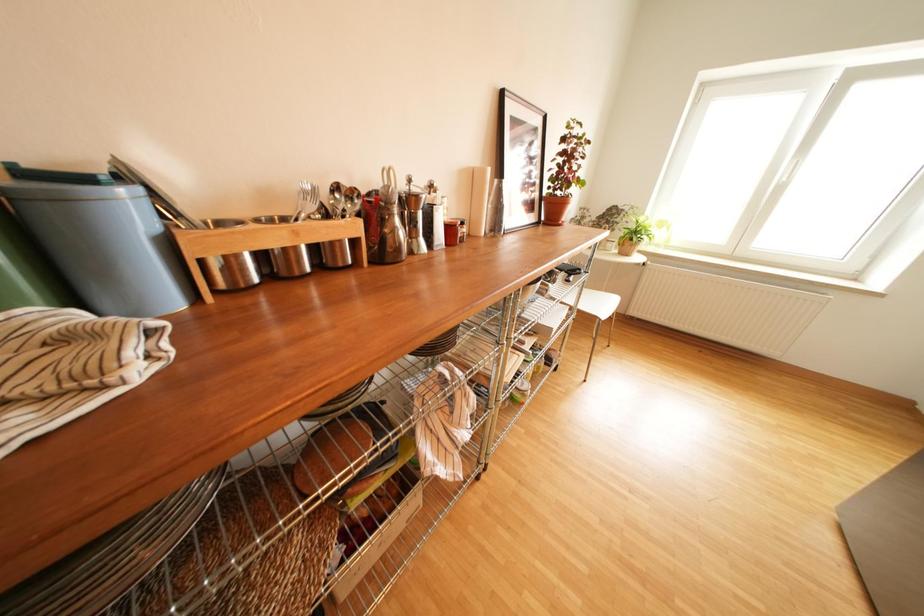
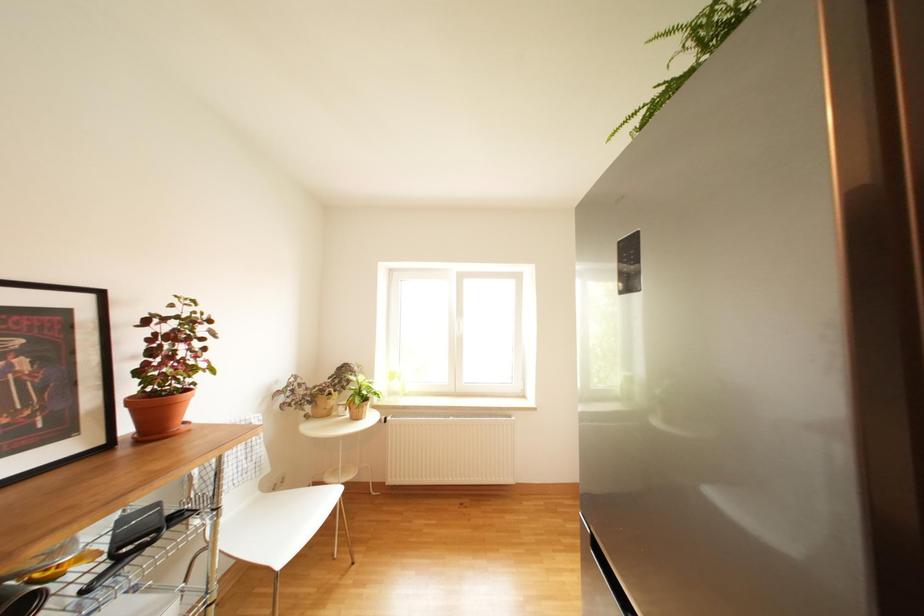
The images are taken continuously from a first-person perspective. In which direction is your viewpoint rotating?

The camera rotated toward right-up.